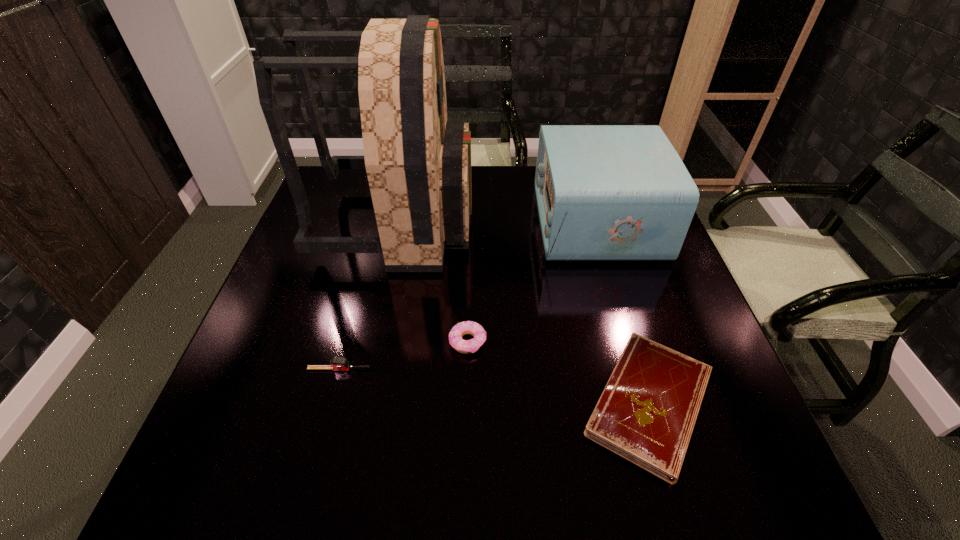
The height and width of the screenshot is (540, 960). I want to click on vacant space that's between the doughnut and the tape measure, so click(x=403, y=355).

Where is `free space between the notebook and the radio receiver`? The image size is (960, 540). free space between the notebook and the radio receiver is located at coordinates (623, 313).

This screenshot has height=540, width=960. What are the coordinates of `free space between the backpack and the doughnut` in the screenshot? It's located at (433, 281).

Where is `free space between the shortest object and the tape measure`? This screenshot has width=960, height=540. free space between the shortest object and the tape measure is located at coordinates (494, 386).

Where is `blank region between the notebook and the doughnut`? This screenshot has width=960, height=540. blank region between the notebook and the doughnut is located at coordinates (559, 373).

Where is `free space between the radio receiver and the tape measure`? The width and height of the screenshot is (960, 540). free space between the radio receiver and the tape measure is located at coordinates (468, 295).

I want to click on vacant space that's between the tallest object and the tape measure, so click(369, 295).

Find the location of a particular element. unoccupied position between the tape measure and the doughnut is located at coordinates (403, 355).

Where is `the closest object to the doughnut`? the closest object to the doughnut is located at coordinates (336, 363).

What are the coordinates of `object that is the fourth closest to the radio receiver` in the screenshot? It's located at (336, 363).